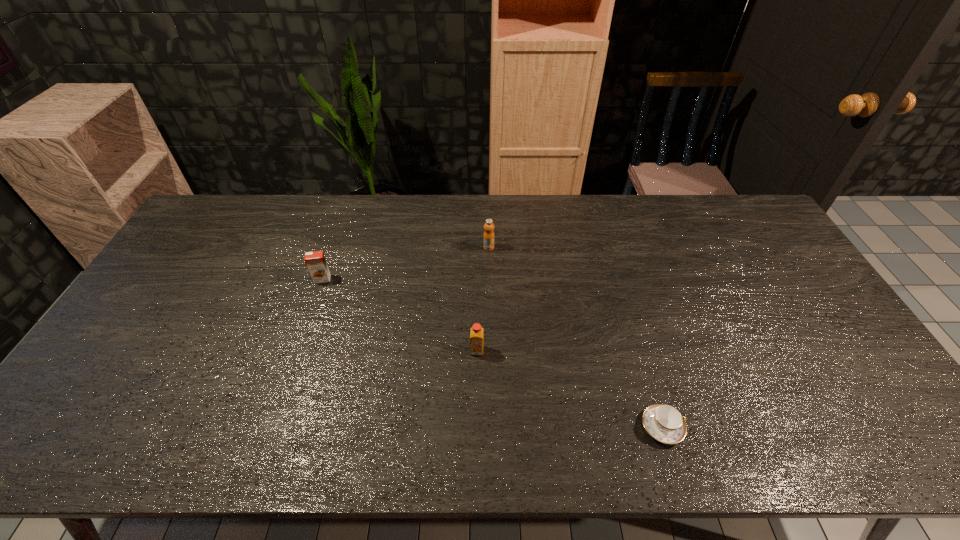
Locate an element on the screen. The width and height of the screenshot is (960, 540). object that can be found as the second closest to the second object from right to left is located at coordinates (315, 261).

At what (x,y) coordinates should I click in order to perform the action: click on orange juice that can be found as the closest to the second orange juice from right to left. Please return your answer as a coordinate pair (x, y). Image resolution: width=960 pixels, height=540 pixels. Looking at the image, I should click on (488, 238).

Locate which orange juice is the closest to the second orange juice from left to right. Please provide its 2D coordinates. Your answer should be formatted as a tuple, i.e. [(x, y)], where the tuple contains the x and y coordinates of a point satisfying the conditions above.

[(488, 238)]